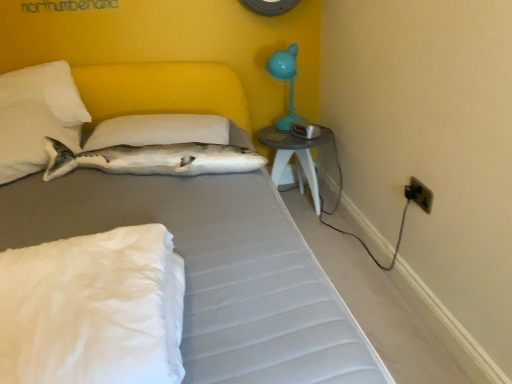
Question: Is white soft pillow at lower left, which ranks as the first pillow in front-to-back order, looking in the opposite direction of white soft pillow at upper center, which is counted as the 1th pillow, starting from the back?

Choices:
 (A) yes
 (B) no

Answer: (A)

Question: Does white soft pillow at lower left, which ranks as the first pillow in front-to-back order, appear on the right side of white soft pillow at upper center, which is counted as the 1th pillow, starting from the back?

Choices:
 (A) yes
 (B) no

Answer: (A)

Question: Can you confirm if white soft pillow at lower left, the third pillow viewed from the back, is shorter than white soft pillow at upper center, which is counted as the 1th pillow, starting from the back?

Choices:
 (A) no
 (B) yes

Answer: (A)

Question: Does white soft pillow at lower left, the third pillow viewed from the back, lie behind white soft pillow at upper center, which is counted as the 1th pillow, starting from the back?

Choices:
 (A) yes
 (B) no

Answer: (B)

Question: From the image's perspective, is white soft pillow at lower left, the third pillow viewed from the back, below white soft pillow at upper center, which ranks as the 3th pillow in front-to-back order?

Choices:
 (A) no
 (B) yes

Answer: (B)

Question: Is white soft pillow at lower left, which ranks as the first pillow in front-to-back order, touching white soft pillow at upper center, which ranks as the 3th pillow in front-to-back order?

Choices:
 (A) no
 (B) yes

Answer: (A)

Question: Would you consider teal plastic table lamp at upper right to be distant from white plush fish at upper left?

Choices:
 (A) yes
 (B) no

Answer: (B)

Question: From the image's perspective, is teal plastic table lamp at upper right under white plush fish at upper left?

Choices:
 (A) yes
 (B) no

Answer: (B)

Question: From the image's perspective, is teal plastic table lamp at upper right above white plush fish at upper left?

Choices:
 (A) yes
 (B) no

Answer: (A)

Question: Is teal plastic table lamp at upper right located outside white plush fish at upper left?

Choices:
 (A) no
 (B) yes

Answer: (B)

Question: Is teal plastic table lamp at upper right facing towards white plush fish at upper left?

Choices:
 (A) no
 (B) yes

Answer: (A)

Question: Considering the relative sizes of teal plastic table lamp at upper right and white plush fish at upper left in the image provided, is teal plastic table lamp at upper right shorter than white plush fish at upper left?

Choices:
 (A) yes
 (B) no

Answer: (B)

Question: Does white plush fish at upper left appear on the left side of white soft pillow at upper center, which ranks as the 3th pillow in front-to-back order?

Choices:
 (A) no
 (B) yes

Answer: (A)